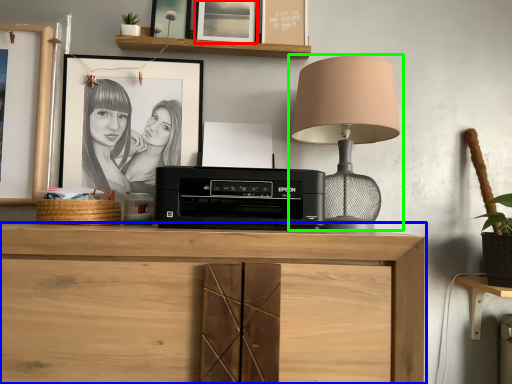
Question: Estimate the real-world distances between objects in this image. Which object is farther from picture frame (highlighted by a red box), chest of drawers (highlighted by a blue box) or lamp (highlighted by a green box)?

Choices:
 (A) chest of drawers
 (B) lamp

Answer: (A)